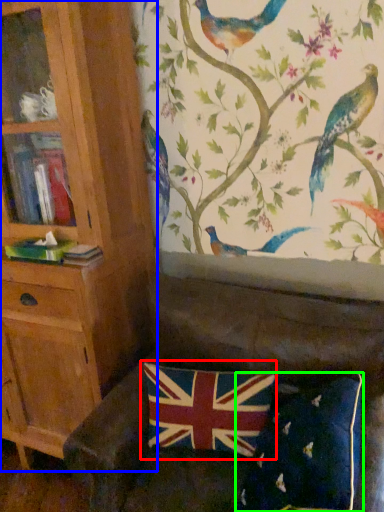
Question: Which object is the closest to the flag (highlighted by a red box)? Choose among these: bookcase (highlighted by a blue box) or pillow (highlighted by a green box).

Choices:
 (A) bookcase
 (B) pillow

Answer: (B)